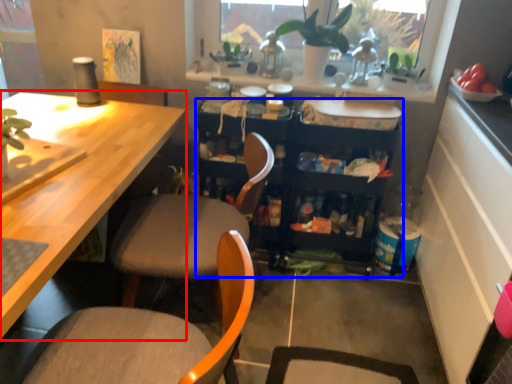
Question: Which point is closer to the camera, desk (highlighted by a red box) or cabinetry (highlighted by a blue box)?

Choices:
 (A) desk
 (B) cabinetry

Answer: (A)